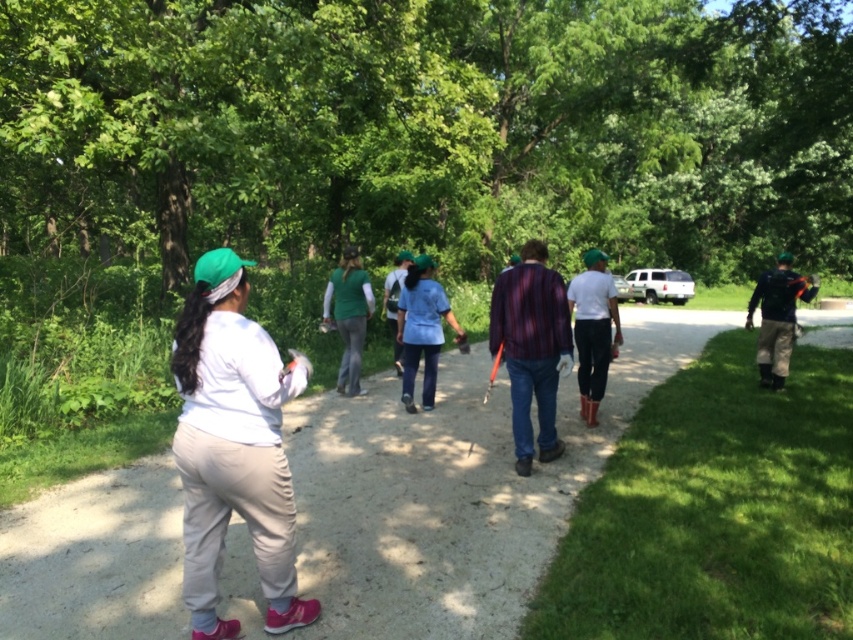
Question: In this image, where is white matte shirt at center located relative to striped cotton shirt at center?

Choices:
 (A) left
 (B) right

Answer: (A)

Question: Does rubber boots at center lie in front of green fabric shirt at center?

Choices:
 (A) yes
 (B) no

Answer: (A)

Question: Among these points, which one is nearest to the camera?

Choices:
 (A) (283, 433)
 (B) (837, 51)

Answer: (A)

Question: Which point appears farthest from the camera in this image?

Choices:
 (A) (338, 387)
 (B) (601, 371)
 (C) (248, 476)
 (D) (767, 348)

Answer: (D)

Question: Is white matte shirt at center above striped cotton shirt at center?

Choices:
 (A) no
 (B) yes

Answer: (A)

Question: Which object is closer to the camera taking this photo?

Choices:
 (A) striped cotton shirt at center
 (B) white matte shirt at center
 (C) white fabric at center

Answer: (B)